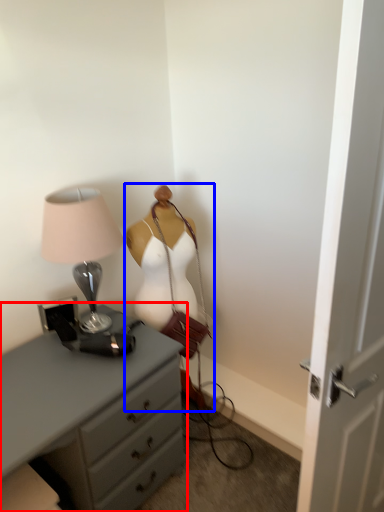
Question: Among these objects, which one is farthest to the camera, chest of drawers (highlighted by a red box) or mannequin (highlighted by a blue box)?

Choices:
 (A) chest of drawers
 (B) mannequin

Answer: (B)